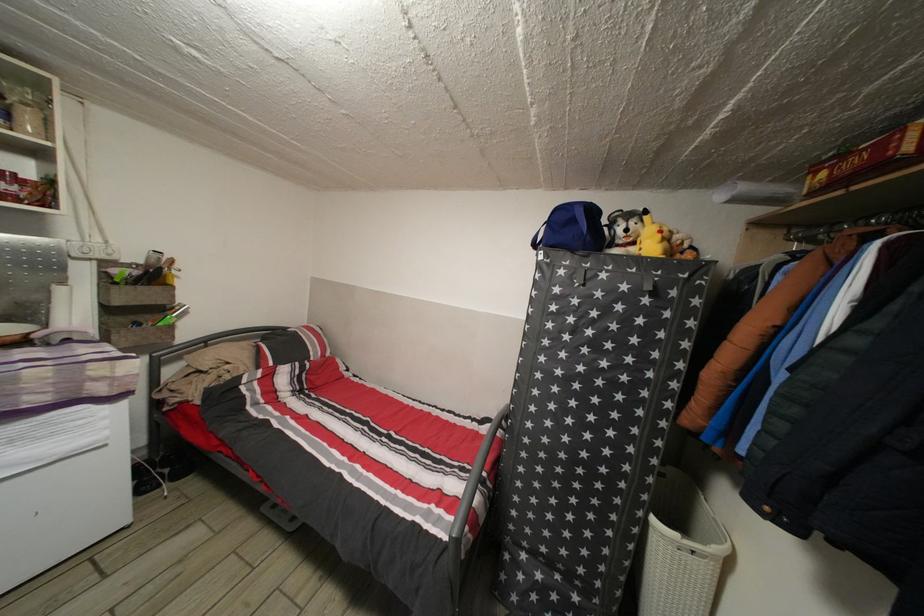
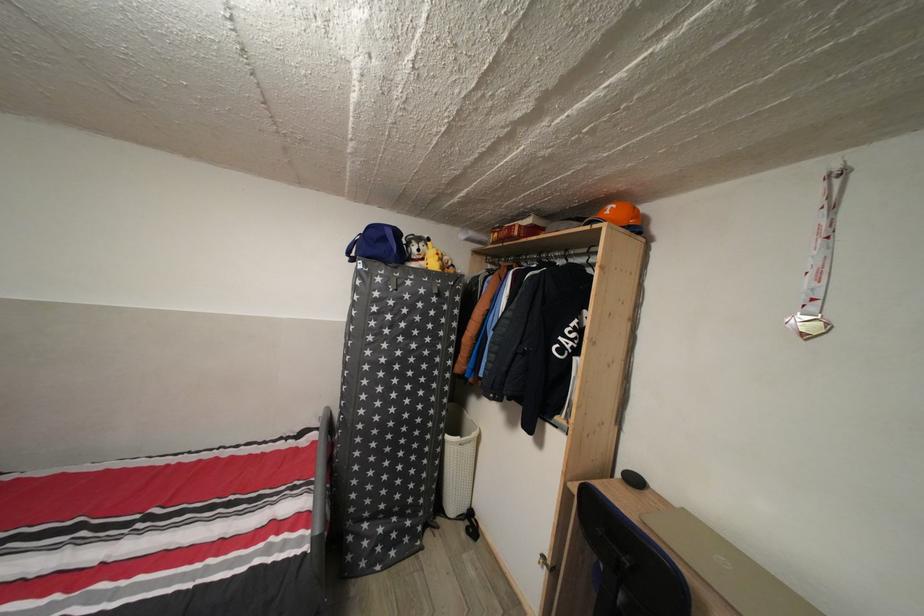
Locate, in the second image, the point that corresponds to [830,180] in the first image.

(503, 241)